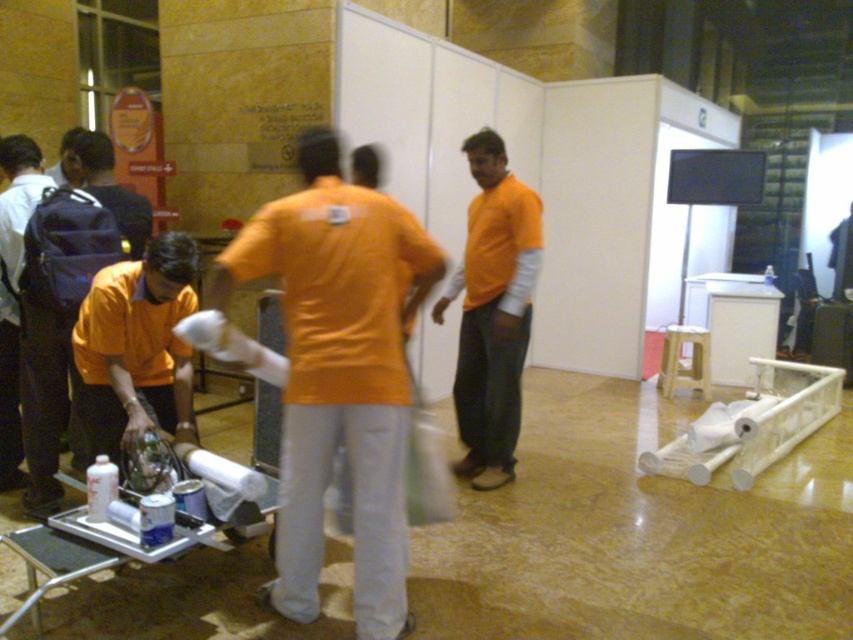
Between matte black backpack at left and matte orange shirt at upper left, which one is positioned higher?

matte orange shirt at upper left is higher up.

Between point (138, 204) and point (61, 163), which one is positioned in front?

Point (138, 204) is more forward.

You are a GUI agent. You are given a task and a screenshot of the screen. Output one action in this format:
    pyautogui.click(x=<x>, y=<y>)
    Task: Click on the matte black backpack at left
    
    Given the screenshot: What is the action you would take?
    pyautogui.click(x=112, y=189)

Is point (479, 417) positioned in front of point (131, 248)?

No, it is not.

In order to click on orange cotton shirt at center in this screenshot , I will do `click(492, 310)`.

Can you confirm if orange matte shirt at center is positioned below matte orange shirt at left?

Yes.

Does point (312, 468) come closer to viewer compared to point (117, 305)?

Yes, point (312, 468) is in front of point (117, 305).

Does point (402, 419) come closer to viewer compared to point (155, 241)?

Yes, it is in front of point (155, 241).

This screenshot has width=853, height=640. What are the coordinates of `orange matte shirt at center` in the screenshot? It's located at coord(339,372).